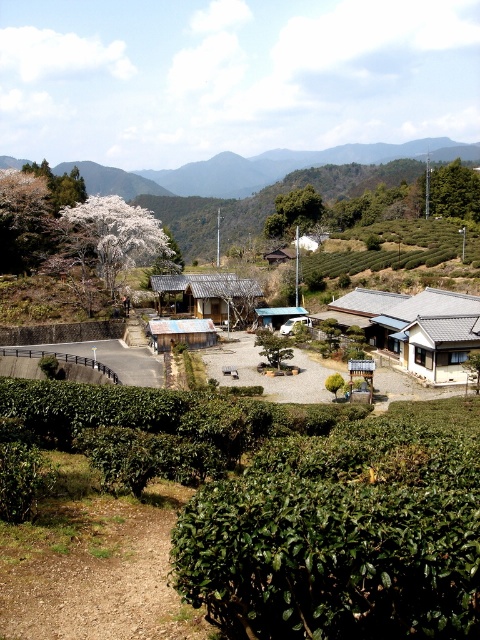
Can you confirm if green leafy tree at center is smaller than metallic blue hut at center?

No.

Who is more forward, (264, 220) or (290, 316)?

Point (290, 316)

Find the location of a particular element. Image resolution: width=480 pixels, height=640 pixels. green leafy tree at center is located at coordinates (294, 212).

Can you confirm if white blossoming tree at upper left is shorter than green leafy tree at upper center?

Indeed, white blossoming tree at upper left has a lesser height compared to green leafy tree at upper center.

Image resolution: width=480 pixels, height=640 pixels. What do you see at coordinates (118, 234) in the screenshot?
I see `white blossoming tree at upper left` at bounding box center [118, 234].

Find the location of a particular element. The height and width of the screenshot is (640, 480). white blossoming tree at upper left is located at coordinates (118, 234).

Describe the element at coordinates (294, 212) in the screenshot. I see `green leafy tree at center` at that location.

Consider the image. Which is more to the left, green leafy tree at center or wooden hut at center?

wooden hut at center

Does point (320, 196) come behind point (178, 340)?

Yes, point (320, 196) is farther from viewer.

This screenshot has width=480, height=640. In order to click on green leafy tree at center in this screenshot , I will do `click(294, 212)`.